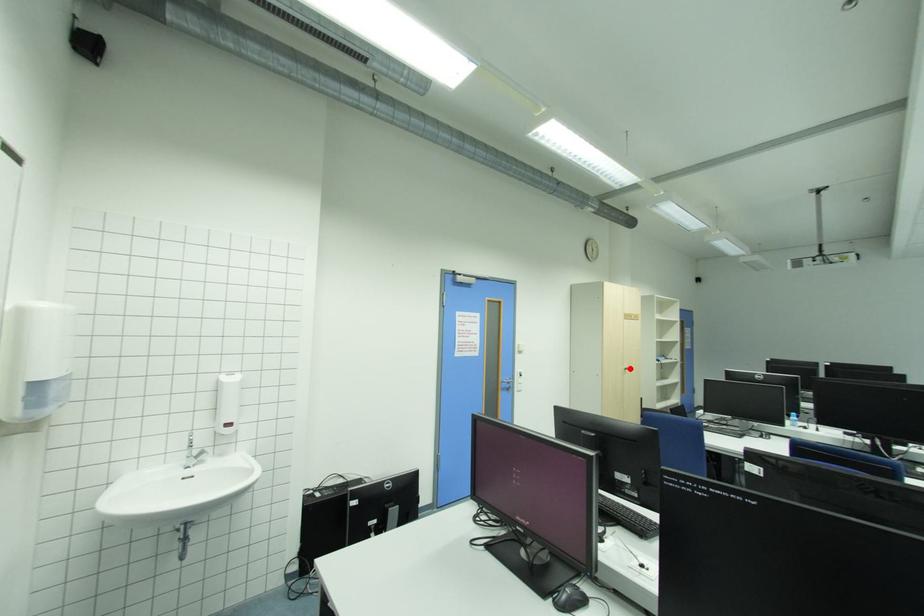
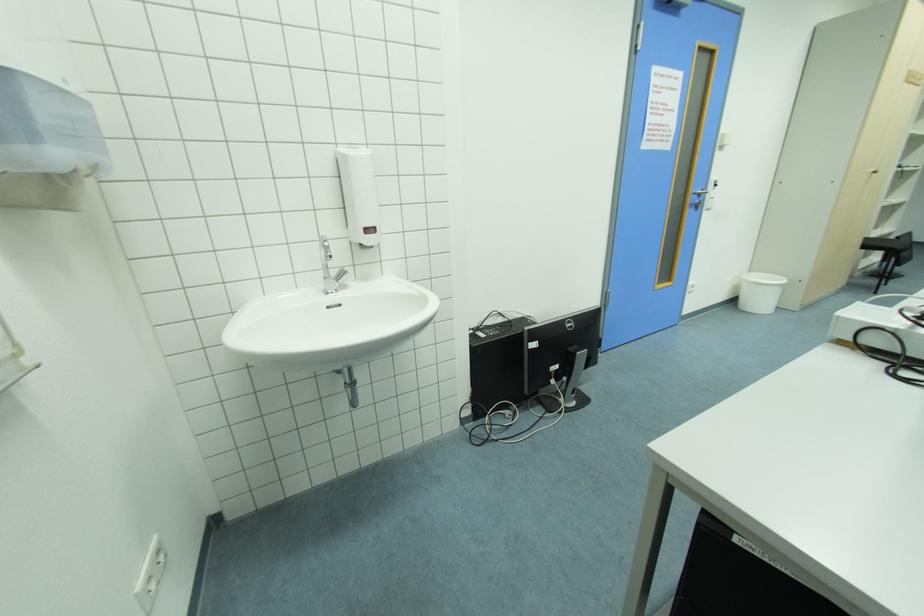
Question: I am providing you with two images of the same scene from different viewpoints. Image1 has a red point marked. In image2, the corresponding 3D location appears at what relative position? Reply with the corresponding letter.

Choices:
 (A) Closer
 (B) Farther

Answer: (B)